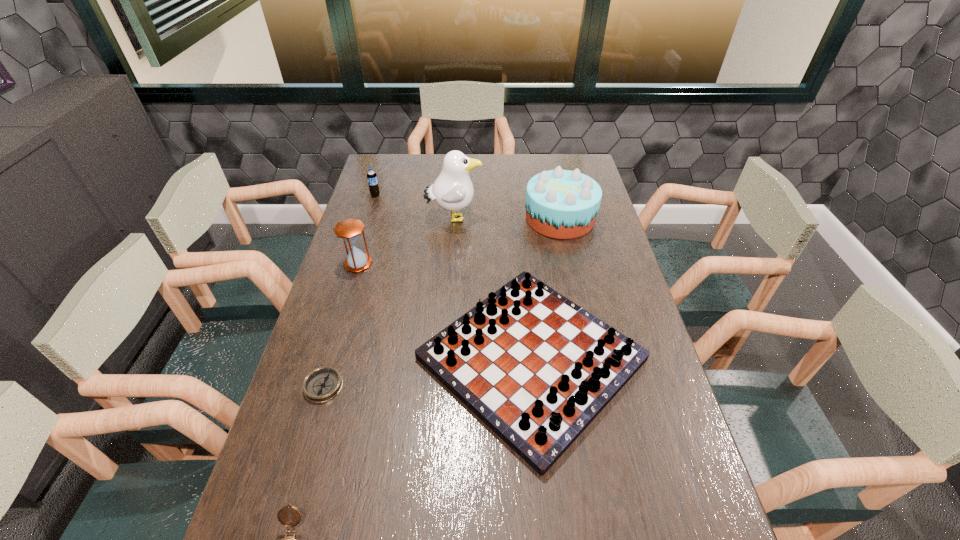
The width and height of the screenshot is (960, 540). I want to click on gull, so click(x=453, y=190).

Identify the location of cake. This screenshot has width=960, height=540. (563, 204).

Find the location of a particular element. This screenshot has height=540, width=960. the fifth shortest object is located at coordinates (349, 230).

I want to click on the fourth nearest object, so click(349, 230).

Locate an element on the screen. The image size is (960, 540). soda bottle is located at coordinates (372, 180).

Image resolution: width=960 pixels, height=540 pixels. In order to click on chessboard in this screenshot , I will do `click(536, 368)`.

Locate an element on the screen. The width and height of the screenshot is (960, 540). the shortest object is located at coordinates (322, 384).

Locate an element on the screen. the shorter compass is located at coordinates (322, 384).

You are a GUI agent. You are given a task and a screenshot of the screen. Output one action in this format:
    pyautogui.click(x=<x>, y=<y>)
    Task: Click on the vacant space situated 0.080m on the beak of the tallest object
    The width and height of the screenshot is (960, 540).
    Given the screenshot: What is the action you would take?
    pyautogui.click(x=504, y=218)

I want to click on blank area located 0.180m on the back of the cake, so pyautogui.click(x=550, y=173).